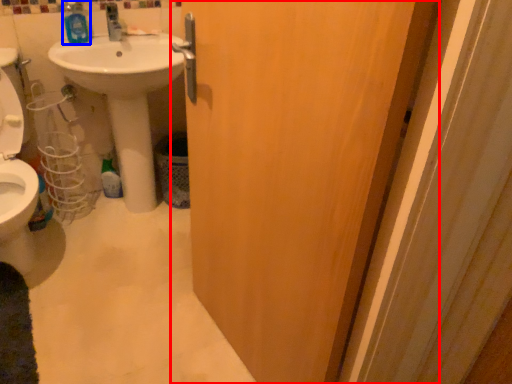
Question: Which object is further to the camera taking this photo, door (highlighted by a red box) or mouthwash (highlighted by a blue box)?

Choices:
 (A) door
 (B) mouthwash

Answer: (B)